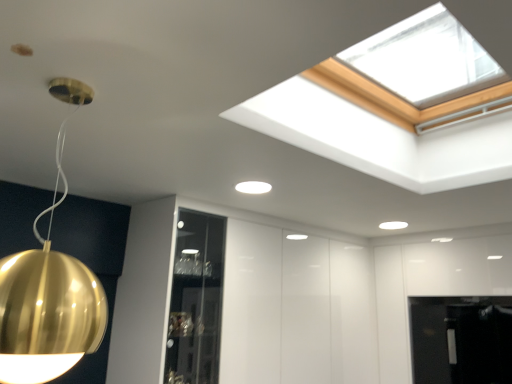
Question: Can you confirm if white matte light fixture at upper center, the first lamp when ordered from bottom to top, is positioned to the right of gold reflective sphere at left, which appears as the 1th lamp when viewed from the left?

Choices:
 (A) yes
 (B) no

Answer: (A)

Question: Can you confirm if white matte light fixture at upper center, the first lamp when ordered from bottom to top, is wider than gold reflective sphere at left, the second lamp when ordered from bottom to top?

Choices:
 (A) yes
 (B) no

Answer: (B)

Question: Is white matte light fixture at upper center, which appears as the second lamp when viewed from the front, in contact with gold reflective sphere at left, the 1th lamp viewed from the front?

Choices:
 (A) yes
 (B) no

Answer: (B)

Question: From a real-world perspective, is white matte light fixture at upper center, which appears as the second lamp when viewed from the left, under gold reflective sphere at left, the second lamp when ordered from bottom to top?

Choices:
 (A) yes
 (B) no

Answer: (B)

Question: Considering the relative sizes of white matte light fixture at upper center, which appears as the second lamp when viewed from the front, and gold reflective sphere at left, the second lamp from the right, in the image provided, is white matte light fixture at upper center, which appears as the second lamp when viewed from the front, thinner than gold reflective sphere at left, the second lamp from the right,?

Choices:
 (A) no
 (B) yes

Answer: (B)

Question: Is white matte light fixture at upper center, which is the first lamp from right to left, looking in the opposite direction of gold reflective sphere at left, the 1th lamp viewed from the front?

Choices:
 (A) yes
 (B) no

Answer: (B)

Question: Considering the relative positions of gold reflective sphere at left, marked as the first lamp in a top-to-bottom arrangement, and white matte light fixture at upper center, which appears as the second lamp when viewed from the left, in the image provided, is gold reflective sphere at left, marked as the first lamp in a top-to-bottom arrangement, to the right of white matte light fixture at upper center, which appears as the second lamp when viewed from the left, from the viewer's perspective?

Choices:
 (A) yes
 (B) no

Answer: (B)

Question: Is gold reflective sphere at left, the 1th lamp viewed from the front, aimed at white matte light fixture at upper center, the 1th lamp in the back-to-front sequence?

Choices:
 (A) no
 (B) yes

Answer: (B)

Question: Is gold reflective sphere at left, the second lamp when ordered from bottom to top, placed right next to white matte light fixture at upper center, the first lamp when ordered from bottom to top?

Choices:
 (A) yes
 (B) no

Answer: (B)

Question: From the image's perspective, is gold reflective sphere at left, the 1th lamp viewed from the front, under white matte light fixture at upper center, which appears as the second lamp when viewed from the left?

Choices:
 (A) yes
 (B) no

Answer: (B)

Question: Is white matte light fixture at upper center, the 2th lamp positioned from the top, inside gold reflective sphere at left, marked as the first lamp in a top-to-bottom arrangement?

Choices:
 (A) yes
 (B) no

Answer: (B)

Question: Is gold reflective sphere at left, which appears as the 1th lamp when viewed from the left, thinner than white matte light fixture at upper center, which appears as the second lamp when viewed from the left?

Choices:
 (A) yes
 (B) no

Answer: (B)

Question: Considering the positions of white matte light fixture at upper center, which appears as the second lamp when viewed from the front, and gold reflective sphere at left, the second lamp when ordered from back to front, in the image, is white matte light fixture at upper center, which appears as the second lamp when viewed from the front, wider or thinner than gold reflective sphere at left, the second lamp when ordered from back to front,?

Choices:
 (A) wide
 (B) thin

Answer: (B)